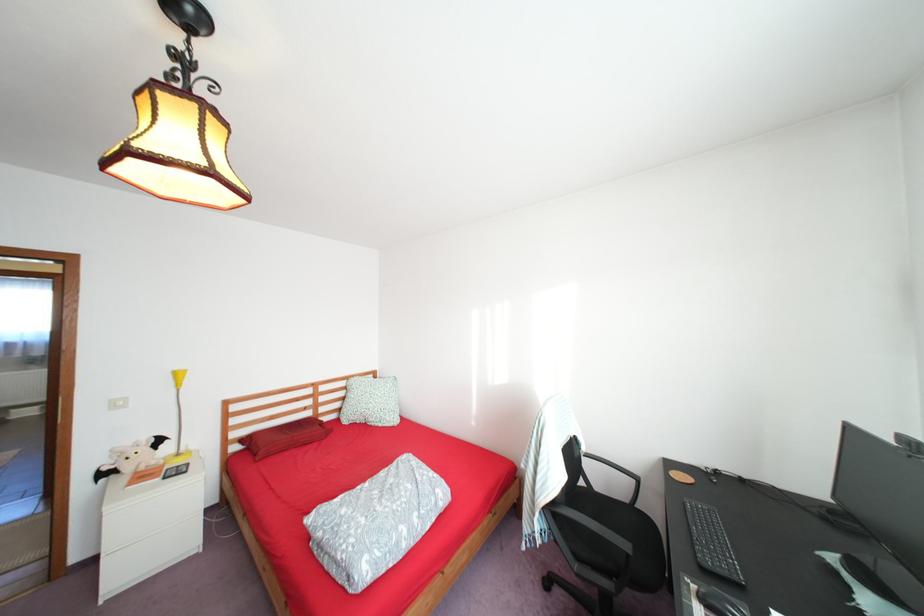
The location [130,456] corresponds to which object?

This point indicates the bat plush toy.